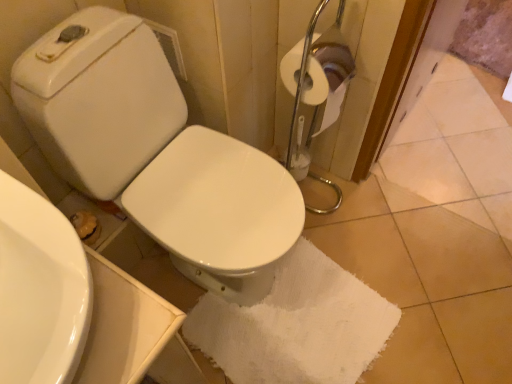
Question: Is white glossy sink at lower left oriented towards white cotton bath towel at center?

Choices:
 (A) no
 (B) yes

Answer: (A)

Question: Is white glossy sink at lower left shorter than white cotton bath towel at center?

Choices:
 (A) yes
 (B) no

Answer: (B)

Question: Is white glossy sink at lower left far away from white cotton bath towel at center?

Choices:
 (A) no
 (B) yes

Answer: (A)

Question: Does white glossy sink at lower left have a larger size compared to white cotton bath towel at center?

Choices:
 (A) yes
 (B) no

Answer: (B)

Question: From the image's perspective, is white glossy sink at lower left under white cotton bath towel at center?

Choices:
 (A) yes
 (B) no

Answer: (B)

Question: Does white glossy sink at lower left come behind white cotton bath towel at center?

Choices:
 (A) no
 (B) yes

Answer: (A)

Question: From a real-world perspective, is white cotton bath towel at center positioned over white glossy toilet at center based on gravity?

Choices:
 (A) yes
 (B) no

Answer: (B)

Question: Is white cotton bath towel at center oriented towards white glossy toilet at center?

Choices:
 (A) no
 (B) yes

Answer: (A)

Question: Is white cotton bath towel at center positioned in front of white glossy toilet at center?

Choices:
 (A) no
 (B) yes

Answer: (A)

Question: From the image's perspective, would you say white cotton bath towel at center is shown under white glossy toilet at center?

Choices:
 (A) no
 (B) yes

Answer: (B)

Question: Can you confirm if white cotton bath towel at center is bigger than white glossy toilet at center?

Choices:
 (A) yes
 (B) no

Answer: (B)

Question: From the image's perspective, is white cotton bath towel at center above white glossy toilet at center?

Choices:
 (A) no
 (B) yes

Answer: (A)

Question: Is white cotton bath towel at center to the right of white glossy sink at lower left from the viewer's perspective?

Choices:
 (A) yes
 (B) no

Answer: (A)